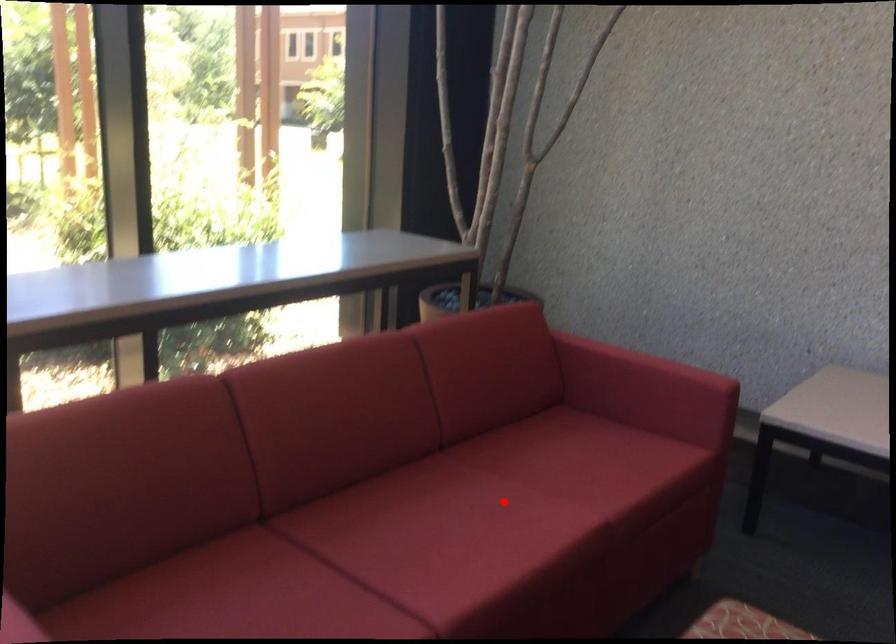
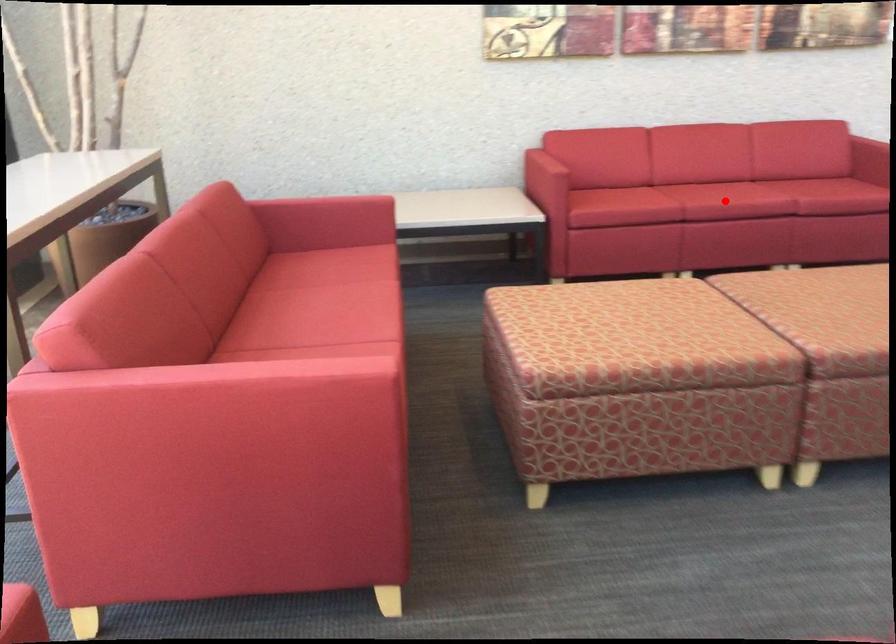
I am providing you with two images of the same scene from different viewpoints. A red point is marked on the first image and another point is marked on the second image. Do the highlighted points in image1 and image2 indicate the same real-world spot?

No